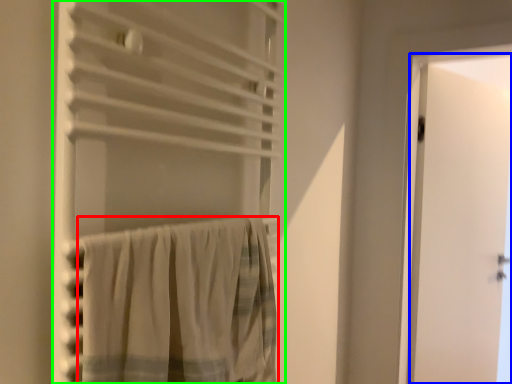
Question: Based on their relative distances, which object is farther from curtain (highlighted by a red box)? Choose from door (highlighted by a blue box) and curtain (highlighted by a green box).

Choices:
 (A) door
 (B) curtain

Answer: (A)